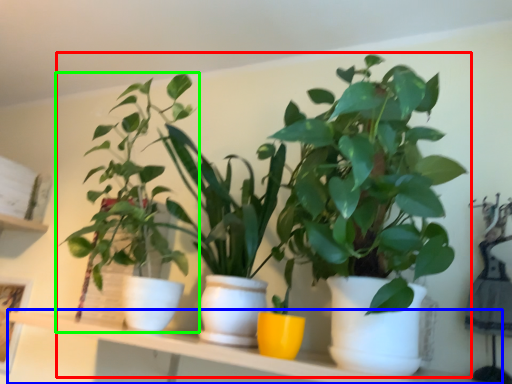
Question: Which is nearer to the houseplant (highlighted by a red box)? window sill (highlighted by a blue box) or houseplant (highlighted by a green box).

Choices:
 (A) window sill
 (B) houseplant

Answer: (B)